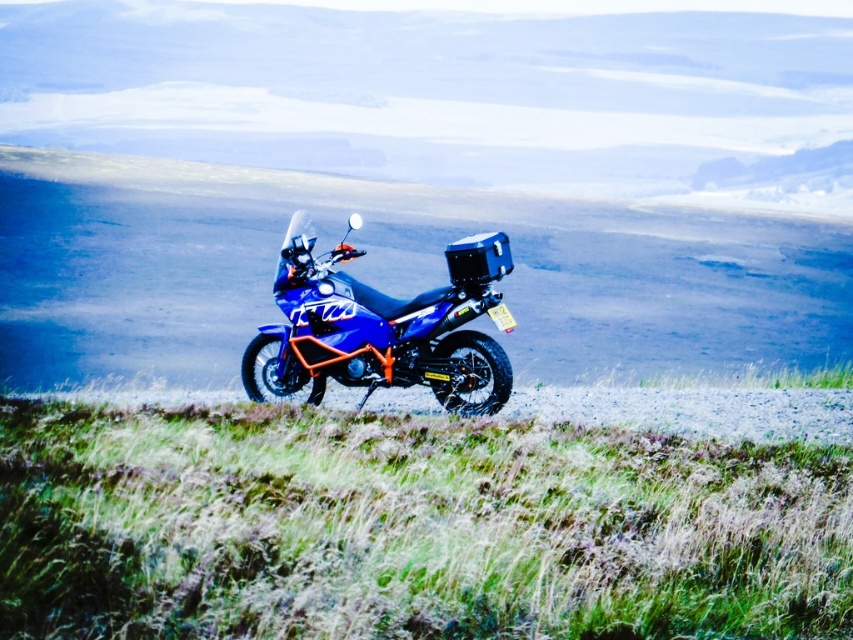
You are a hiker who wants to place a 2 meter long tent between the blue adventure motorcycle and the green grassy at center. Is there enough space?

The distance between the blue adventure motorcycle and the green grassy at center is 4.22 meters. Since the tent is 2 meters long, there is enough space to place it between them.

You are a photographer planning to take a picture of the blue matte motorcycle at center. You want to ensure the green grassy at center is visible in the background. Based on their sizes, will the motorcycle block the view of the grassy area?

The green grassy at center is not as tall as the blue matte motorcycle at center, so the motorcycle will block the view of the grassy area in the background.

You are a hiker standing on the gravel path and see the green grassy at center and the blue matte motorcycle at center. Which object is closer to the ground?

The green grassy at center is closer to the ground as it is located below the blue matte motorcycle at center.